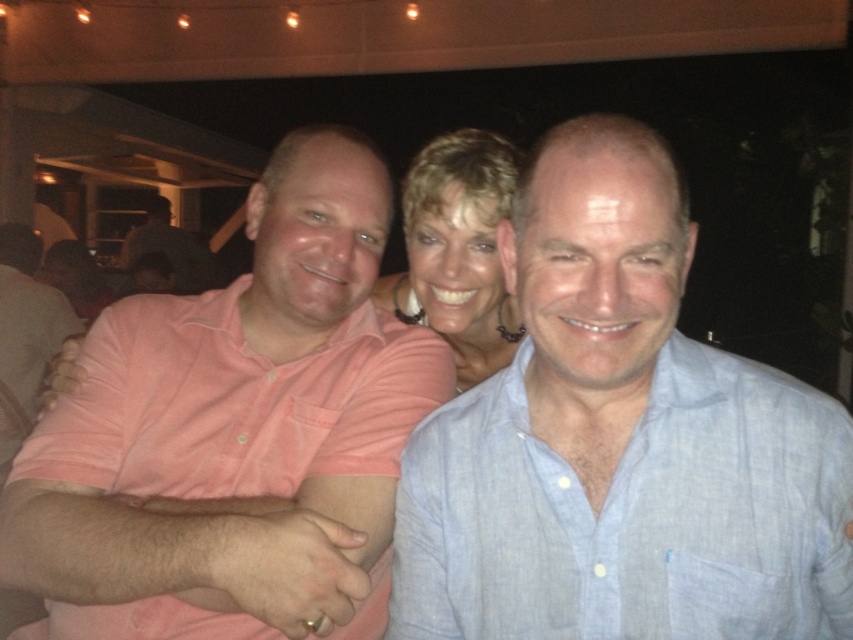
Between pink cotton shirt at center and matte gold necklace at center, which one is positioned higher?

matte gold necklace at center is higher up.

Is point (41, 490) farther from viewer compared to point (471, 160)?

No, it is in front of (471, 160).

Is point (45, 458) positioned in front of point (492, 182)?

Yes, point (45, 458) is in front of point (492, 182).

Find the location of a particular element. The image size is (853, 640). pink cotton shirt at center is located at coordinates coord(236,432).

Does light blue linen shirt at center appear over matte gold necklace at center?

No.

This screenshot has width=853, height=640. Describe the element at coordinates (619, 442) in the screenshot. I see `light blue linen shirt at center` at that location.

This screenshot has width=853, height=640. I want to click on light blue linen shirt at center, so click(619, 442).

What are the coordinates of `light blue linen shirt at center` in the screenshot? It's located at (619, 442).

Can you confirm if light blue linen shirt at center is shorter than pink cotton shirt at center?

Yes.

Which is behind, point (666, 404) or point (132, 413)?

Point (132, 413)

At what (x,y) coordinates should I click in order to perform the action: click on light blue linen shirt at center. Please return your answer as a coordinate pair (x, y). Looking at the image, I should click on click(x=619, y=442).